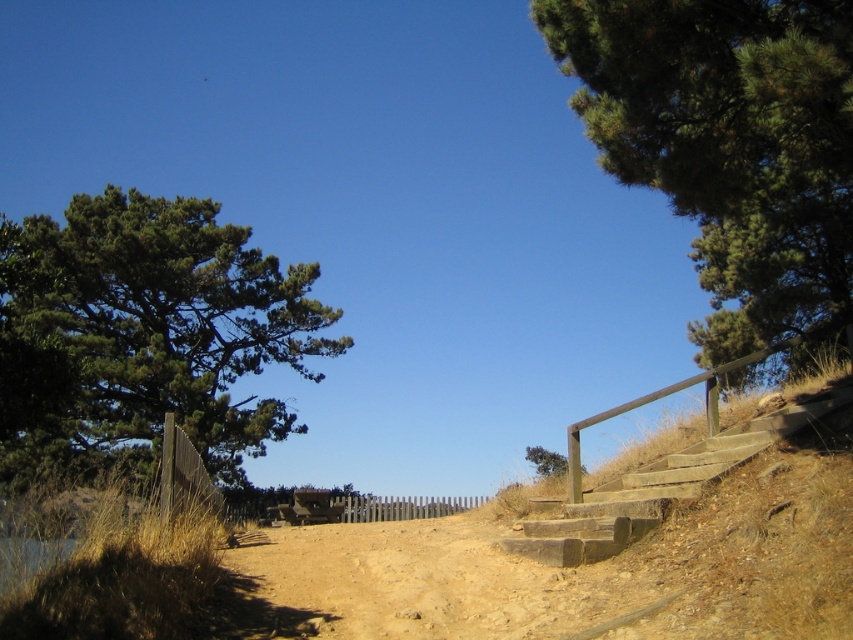
What do you see at coordinates (728, 134) in the screenshot?
I see `green textured tree at upper right` at bounding box center [728, 134].

Can you confirm if green textured tree at upper right is shorter than wooden stairs at center-right?

No, green textured tree at upper right is not shorter than wooden stairs at center-right.

Describe the element at coordinates (728, 134) in the screenshot. I see `green textured tree at upper right` at that location.

You are a GUI agent. You are given a task and a screenshot of the screen. Output one action in this format:
    pyautogui.click(x=<x>, y=<y>)
    Task: Click on the green textured tree at upper right
    
    Given the screenshot: What is the action you would take?
    pyautogui.click(x=728, y=134)

Is green needle-like tree at left to the right of green matte tree at center from the viewer's perspective?

Incorrect, green needle-like tree at left is not on the right side of green matte tree at center.

Does green needle-like tree at left have a greater height compared to green matte tree at center?

Indeed, green needle-like tree at left has a greater height compared to green matte tree at center.

Where is `green needle-like tree at left`? Image resolution: width=853 pixels, height=640 pixels. green needle-like tree at left is located at coordinates (146, 330).

Where is `green needle-like tree at left`? green needle-like tree at left is located at coordinates (146, 330).

Does green needle-like tree at left have a lesser width compared to wooden stairs at center-right?

No.

Can you confirm if green needle-like tree at left is bigger than wooden stairs at center-right?

Yes.

The width and height of the screenshot is (853, 640). In order to click on green needle-like tree at left in this screenshot , I will do `click(146, 330)`.